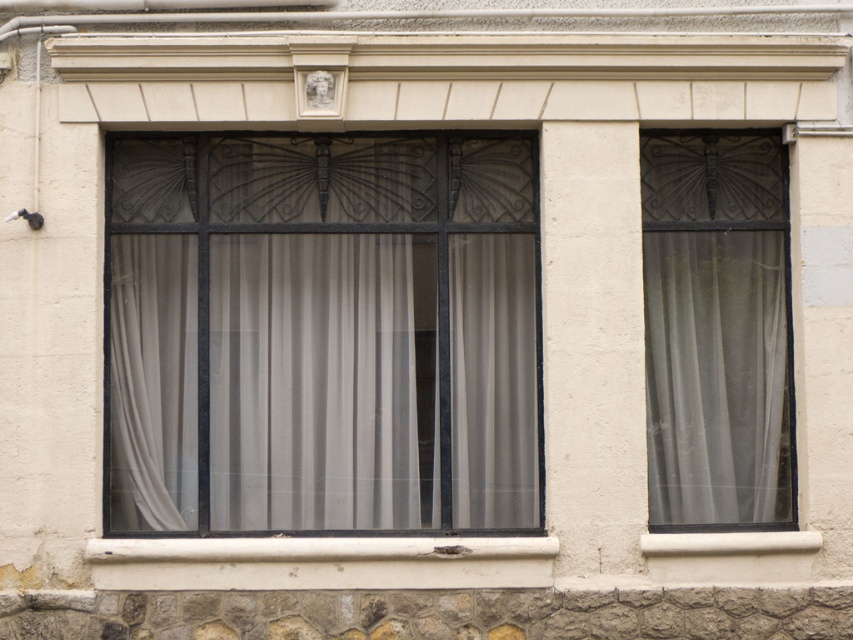
You are standing in front of the building facade and notice two points marked on the wall. The first point is at coordinate point (369,428) and the second is at point (782,392). Based on their positions, which point is closer to you?

Point (369,428) is in front of point (782,392), so it is closer to you.

You are a window installer who needs to replace the curtains between the translucent fabric window at center and the matte glass window at right. The new curtains require 40 inches of space between the windows. Can you install them without moving the existing windows?

The distance between the translucent fabric window at center and the matte glass window at right is 36.71 inches, which is less than the required 40 inches. Therefore, the new curtains cannot be installed without moving the existing windows.